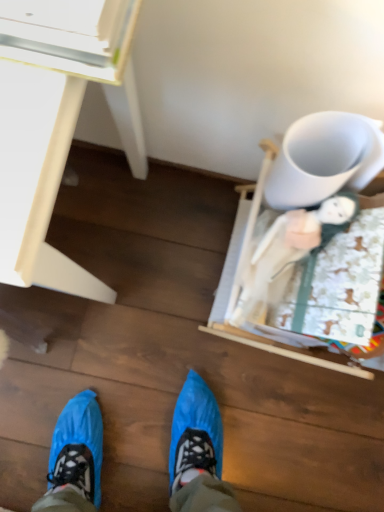
In order to face white glossy desk at upper left, should I rotate leftwards or rightwards?

To align with it, rotate left about 23.389°.

This screenshot has width=384, height=512. Describe the element at coordinates (53, 122) in the screenshot. I see `white glossy desk at upper left` at that location.

Locate an element on the screen. white glossy desk at upper left is located at coordinates (53, 122).

What do you see at coordinates (324, 159) in the screenshot? This screenshot has height=512, width=384. I see `white matte mug at upper right` at bounding box center [324, 159].

Find the location of a particular element. The height and width of the screenshot is (512, 384). white matte mug at upper right is located at coordinates (324, 159).

This screenshot has height=512, width=384. I want to click on white glossy desk at upper left, so click(x=53, y=122).

Is white glossy desk at upper left at the right side of white matte mug at upper right?

In fact, white glossy desk at upper left is to the left of white matte mug at upper right.

Considering the positions of objects white glossy desk at upper left and white matte mug at upper right in the image provided, who is behind, white glossy desk at upper left or white matte mug at upper right?

white matte mug at upper right is behind.

Is point (59, 185) less distant than point (301, 168)?

No, (59, 185) is further to viewer.

From the image's perspective, is white glossy desk at upper left on top of white matte mug at upper right?

No, from the image's perspective, white glossy desk at upper left is not over white matte mug at upper right.

Looking at this image, from a real-world perspective, is white glossy desk at upper left under white matte mug at upper right?

Yes, from a real-world perspective, white glossy desk at upper left is beneath white matte mug at upper right.

Based on the photo, which object is wider, white glossy desk at upper left or white matte mug at upper right?

With larger width is white glossy desk at upper left.

Considering the sizes of objects white glossy desk at upper left and white matte mug at upper right in the image provided, who is shorter, white glossy desk at upper left or white matte mug at upper right?

white matte mug at upper right is shorter.

Who is smaller, white glossy desk at upper left or white matte mug at upper right?

white matte mug at upper right is smaller.

In the scene shown: Is white glossy desk at upper left spatially inside white matte mug at upper right, or outside of it?

white glossy desk at upper left exists outside the volume of white matte mug at upper right.

Is white glossy desk at upper left with white matte mug at upper right?

No, white glossy desk at upper left is not with white matte mug at upper right.

Could you tell me if white glossy desk at upper left is turned towards white matte mug at upper right?

No, white glossy desk at upper left is not turned towards white matte mug at upper right.

What's the angular difference between white glossy desk at upper left and white matte mug at upper right's facing directions?

white glossy desk at upper left and white matte mug at upper right are facing 29.3 degrees away from each other.

This screenshot has height=512, width=384. In the image, there is a white matte mug at upper right. What are the coordinates of `desk below it (from a real-world perspective)` in the screenshot? It's located at (53, 122).

Between white matte mug at upper right and white glossy desk at upper left, which one appears on the right side from the viewer's perspective?

Positioned to the right is white matte mug at upper right.

Which is behind, white matte mug at upper right or white glossy desk at upper left?

white matte mug at upper right is more distant.

Does point (355, 134) come farther from viewer compared to point (24, 222)?

That is True.

From the image's perspective, which object appears higher, white matte mug at upper right or white glossy desk at upper left?

white matte mug at upper right is shown above in the image.

From a real-world perspective, which is physically above, white matte mug at upper right or white glossy desk at upper left?

white matte mug at upper right, from a real-world perspective.

In the scene shown: Considering the sizes of objects white matte mug at upper right and white glossy desk at upper left in the image provided, who is wider, white matte mug at upper right or white glossy desk at upper left?

white glossy desk at upper left is wider.

In the scene shown: Does white matte mug at upper right have a greater height compared to white glossy desk at upper left?

In fact, white matte mug at upper right may be shorter than white glossy desk at upper left.

Is white matte mug at upper right bigger or smaller than white glossy desk at upper left?

Clearly, white matte mug at upper right is smaller in size than white glossy desk at upper left.

Is white matte mug at upper right completely or partially outside of white glossy desk at upper left?

Yes, white matte mug at upper right is located beyond the bounds of white glossy desk at upper left.

Is white matte mug at upper right far away from white glossy desk at upper left?

white matte mug at upper right is actually quite close to white glossy desk at upper left.

Is white glossy desk at upper left at the back of white matte mug at upper right?

No, white matte mug at upper right is not facing away from white glossy desk at upper left.

How many degrees apart are the facing directions of white matte mug at upper right and white glossy desk at upper left?

They differ by 29.3 degrees in their facing directions.

In the image, there is a white matte mug at upper right. Where is `desk below it (from the image's perspective)`? Image resolution: width=384 pixels, height=512 pixels. desk below it (from the image's perspective) is located at coordinates (53, 122).

Where is `desk in front of the white matte mug at upper right`? This screenshot has width=384, height=512. desk in front of the white matte mug at upper right is located at coordinates (53, 122).

Find the location of a particular element. Image resolution: width=384 pixels, height=512 pixels. mug lying behind the white glossy desk at upper left is located at coordinates (324, 159).